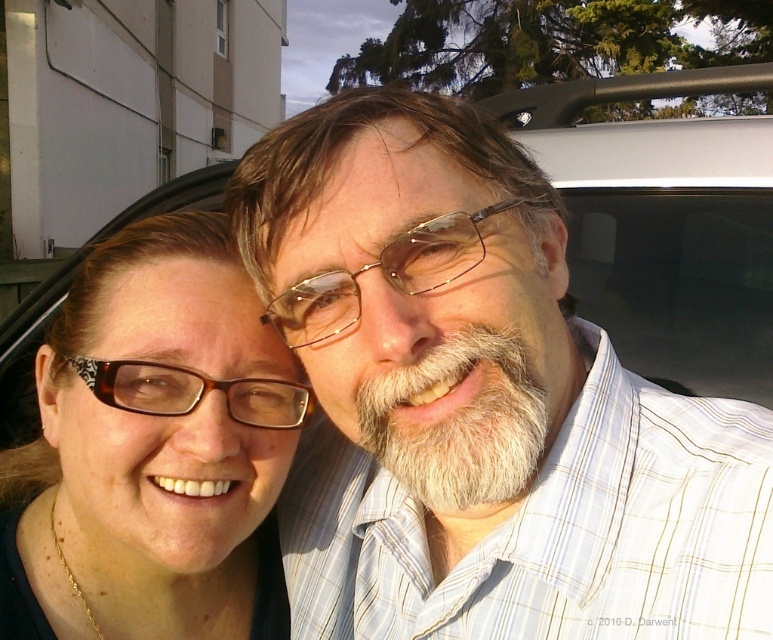
You are a pedestrian looking at the scene. You see the transparent glass car window at upper center and the metallic gold glasses at center. Which object is higher in the image?

The transparent glass car window at upper center is above metallic gold glasses at center, so it is higher in the image.

You are a photographer trying to capture a closeup of the white fuzzy beard at center and the metallic gold glasses at center. Which object should you zoom in on more to ensure both are in focus?

The white fuzzy beard at center is smaller than metallic gold glasses at center, so you should zoom in more on the white fuzzy beard at center to ensure both are in focus.

You are standing in front of a car and see a point marked at coordinates (552, 474). If the point is 29.72 inches away from the camera, can you determine if this point is closer to the camera than the car?

The point at coordinates (552, 474) is 29.72 inches away from the camera. Since the car is part of the scene but its distance isn not specified, we cannot definitively compare their distances. However, typically, if the point is within the car area, it would be farther than the car itself. But without explicit car distance data, it remains uncertain.